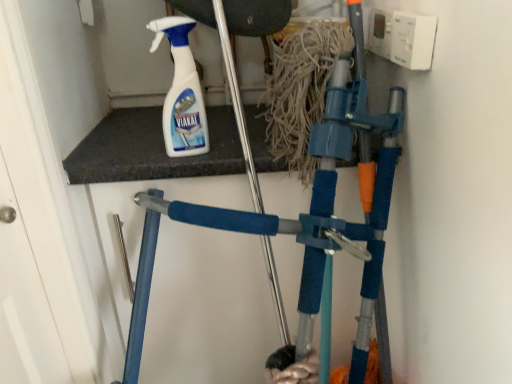
Question: From the image's perspective, is blue foam crutch at center located above or below white plastic spray bottle at upper center?

Choices:
 (A) below
 (B) above

Answer: (A)

Question: Is blue foam crutch at center taller or shorter than white plastic spray bottle at upper center?

Choices:
 (A) short
 (B) tall

Answer: (B)

Question: Looking at the image, does blue foam crutch at center seem bigger or smaller compared to white plastic spray bottle at upper center?

Choices:
 (A) big
 (B) small

Answer: (A)

Question: Would you say white plastic spray bottle at upper center is to the left or to the right of blue foam crutch at center in the picture?

Choices:
 (A) left
 (B) right

Answer: (A)

Question: From their relative heights in the image, would you say white plastic spray bottle at upper center is taller or shorter than blue foam crutch at center?

Choices:
 (A) tall
 (B) short

Answer: (B)

Question: From the image's perspective, is white plastic spray bottle at upper center positioned above or below blue foam crutch at center?

Choices:
 (A) above
 (B) below

Answer: (A)

Question: Does point (199, 140) appear closer or farther from the camera than point (348, 236)?

Choices:
 (A) farther
 (B) closer

Answer: (B)